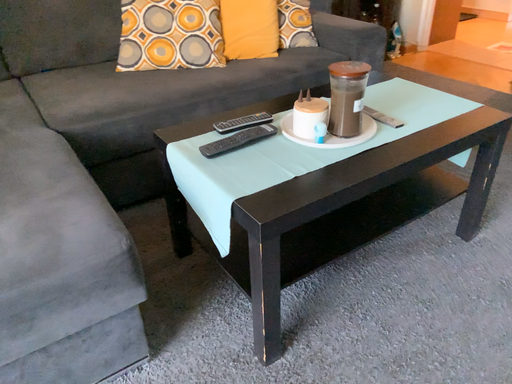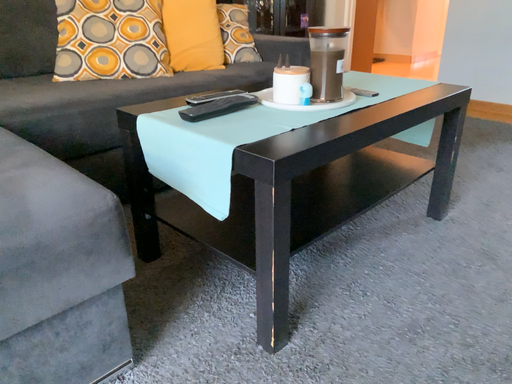
Question: Which way did the camera rotate in the video?

Choices:
 (A) rotated right
 (B) rotated left

Answer: (A)